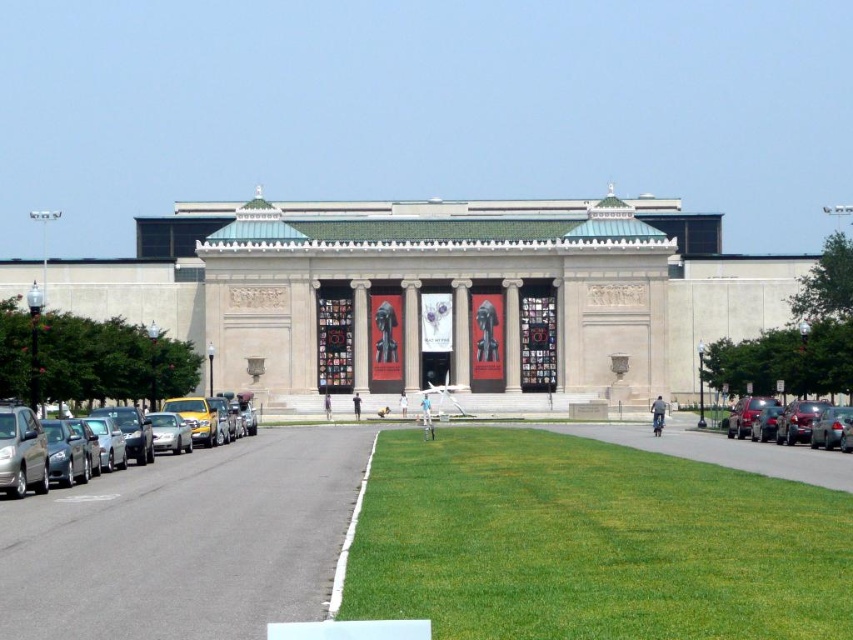
You are a visitor arriving at the classical building and see the green grass at center and the shiny silver sedan at left. Which object is closer to the building?

The green grass at center is closer to the building because it is in front of the shiny silver sedan at left.

You are standing in front of the classical building and want to find the green grass at center. Based on the coordinates provided, where should you look relative to the building?

The green grass at center is located at coordinates point (592, 541), which means it is positioned to the right and slightly below the center point of the image, so you should look towards the lower right area relative to the building.